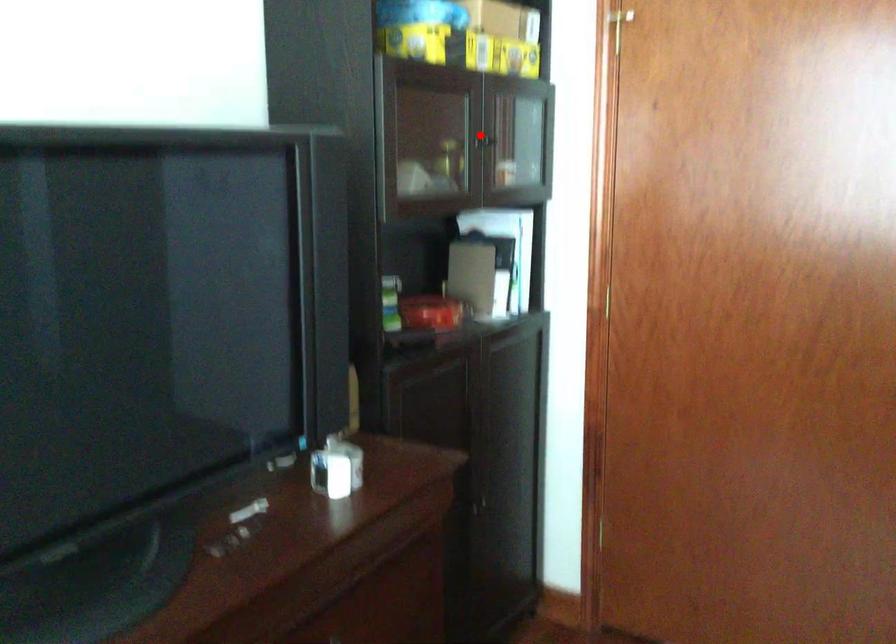
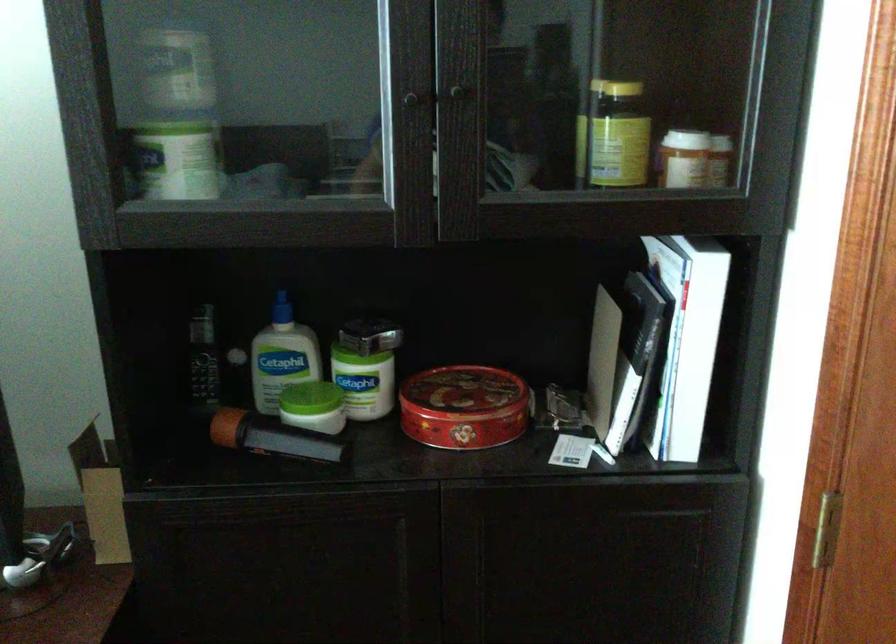
Question: I am providing you with two images of the same scene from different viewpoints. A red point is shown in image1. For the corresponding object point in image2, is it positioned nearer or farther from the camera?

Choices:
 (A) Nearer
 (B) Farther

Answer: (A)